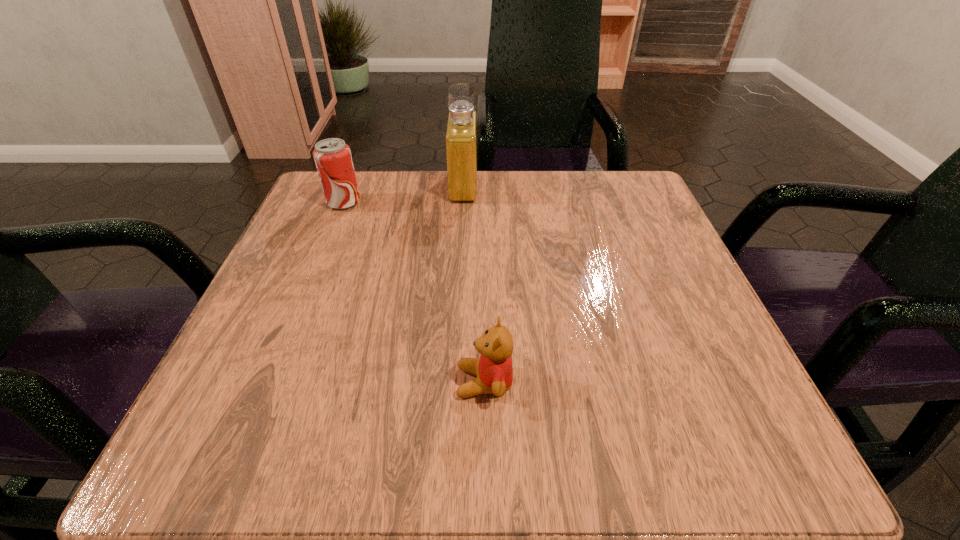
At what (x,y) coordinates should I click in order to perform the action: click on perfume that is at the far edge. Please return your answer as a coordinate pair (x, y). The height and width of the screenshot is (540, 960). Looking at the image, I should click on (461, 128).

I want to click on soda can positioned at the far edge, so click(x=333, y=159).

At what (x,y) coordinates should I click in order to perform the action: click on object that is at the near edge. Please return your answer as a coordinate pair (x, y). Looking at the image, I should click on (494, 370).

You are a GUI agent. You are given a task and a screenshot of the screen. Output one action in this format:
    pyautogui.click(x=<x>, y=<y>)
    Task: Click on the object positioned at the left edge
    The width and height of the screenshot is (960, 540).
    Given the screenshot: What is the action you would take?
    pyautogui.click(x=333, y=159)

Image resolution: width=960 pixels, height=540 pixels. I want to click on object at the far left corner, so click(x=333, y=159).

Where is `free space at the far edge of the desktop`? free space at the far edge of the desktop is located at coordinates (468, 230).

At what (x,y) coordinates should I click in order to perform the action: click on vacant space at the near edge of the desktop. Please return your answer as a coordinate pair (x, y). Looking at the image, I should click on coord(455,414).

In the image, there is a desktop. What are the coordinates of `free region at the left edge` in the screenshot? It's located at (284, 308).

I want to click on vacant space at the right edge of the desktop, so click(x=652, y=306).

In order to click on vacant space at the far left corner of the desktop in this screenshot , I will do `click(372, 186)`.